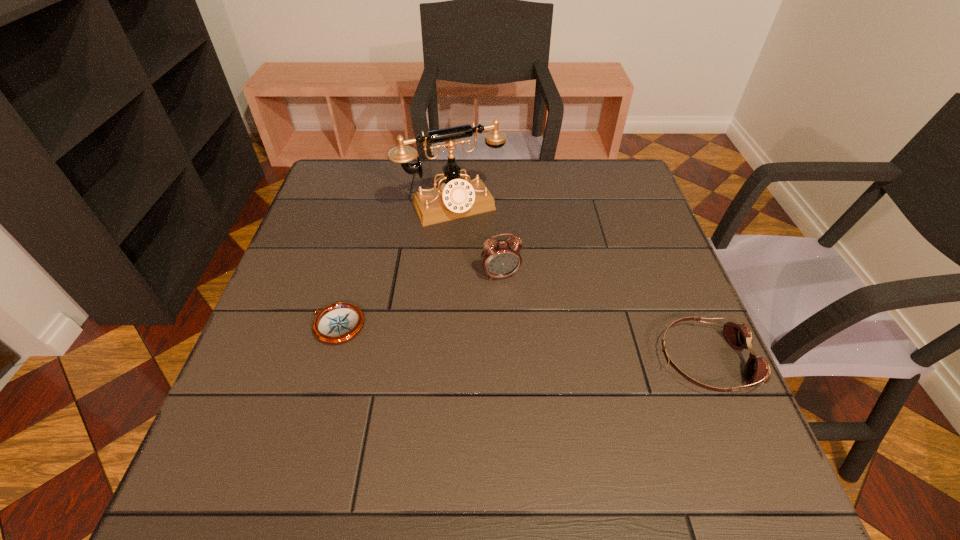
Where is `vacant space located 0.320m on the face of the third nearest object`? This screenshot has height=540, width=960. vacant space located 0.320m on the face of the third nearest object is located at coordinates (548, 408).

The width and height of the screenshot is (960, 540). Identify the location of vacant area situated 0.310m on the face of the third nearest object. (546, 403).

This screenshot has height=540, width=960. I want to click on free space located 0.210m on the dial of the tallest object, so click(499, 279).

At what (x,y) coordinates should I click in order to perform the action: click on free space located 0.220m on the dial of the tallest object. Please return your answer as a coordinate pair (x, y). This screenshot has height=540, width=960. Looking at the image, I should click on (501, 282).

Locate an element on the screen. The height and width of the screenshot is (540, 960). free space located on the dial of the tallest object is located at coordinates (484, 252).

Identify the location of object located at the far edge. (456, 198).

Image resolution: width=960 pixels, height=540 pixels. I want to click on object that is positioned at the near edge, so click(x=739, y=336).

Where is `object situated at the left edge`? object situated at the left edge is located at coordinates (337, 323).

I want to click on object located at the right edge, so click(x=739, y=336).

Identify the location of object that is at the near right corner. (739, 336).